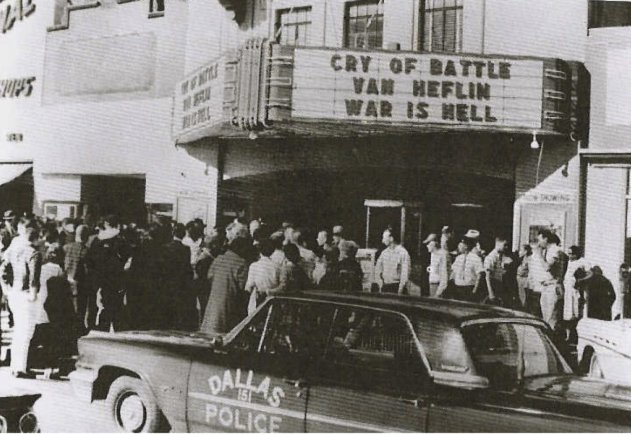
Find the location of a particular element. This screenshot has height=434, width=631. door is located at coordinates (269, 404).